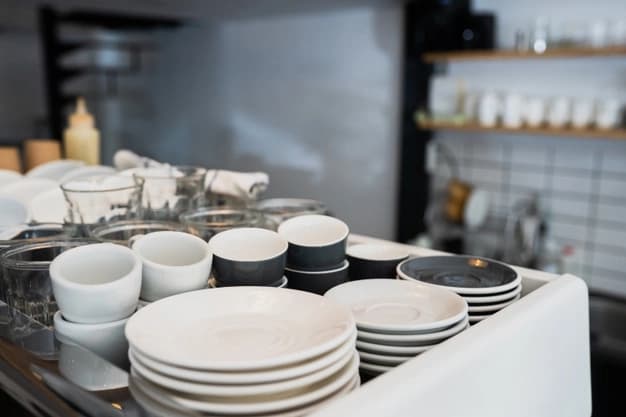
Where is `black shelf`? black shelf is located at coordinates (105, 92), (96, 66), (100, 43), (108, 20).